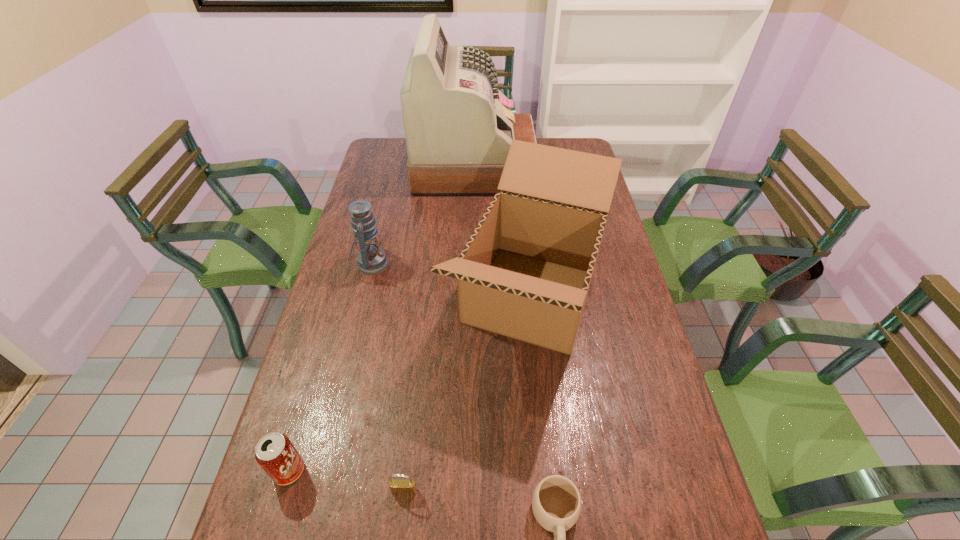
You are a GUI agent. You are given a task and a screenshot of the screen. Output one action in this format:
    pyautogui.click(x=<x>, y=<y>)
    Task: Click on the free space between the third tallest object and the farthest object
    
    Given the screenshot: What is the action you would take?
    pyautogui.click(x=422, y=215)

Find the location of a particular element. empty space between the lantern and the soda can is located at coordinates (330, 367).

Select which object is the fourth closest to the padlock. Please provide its 2D coordinates. Your answer should be formatted as a tuple, i.e. [(x, y)], where the tuple contains the x and y coordinates of a point satisfying the conditions above.

[(372, 260)]

The height and width of the screenshot is (540, 960). In order to click on object that is the fourth closest to the fifth shortest object in this screenshot , I will do `click(407, 486)`.

The width and height of the screenshot is (960, 540). I want to click on free space that satisfies the following two spatial constraints: 1. on the operating side of the cash register; 2. on the right side of the second tallest object, so click(472, 298).

Find the location of a particular element. free location that satisfies the following two spatial constraints: 1. on the front-facing side of the box; 2. on the left side of the third tallest object is located at coordinates (363, 298).

What are the coordinates of `vacant area that satisfies the following two spatial constraints: 1. on the operating side of the cash register; 2. on the front-facing side of the padlock` in the screenshot? It's located at (468, 491).